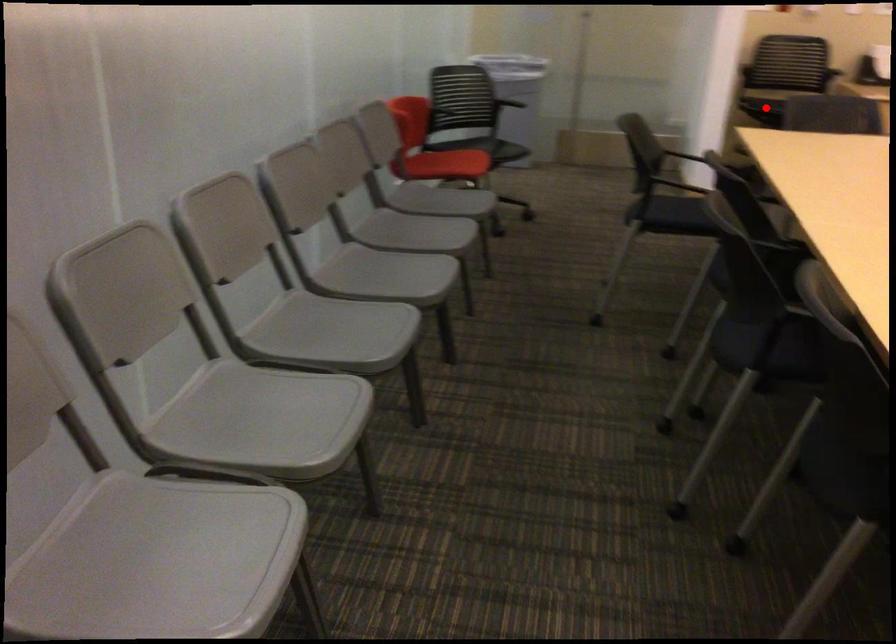
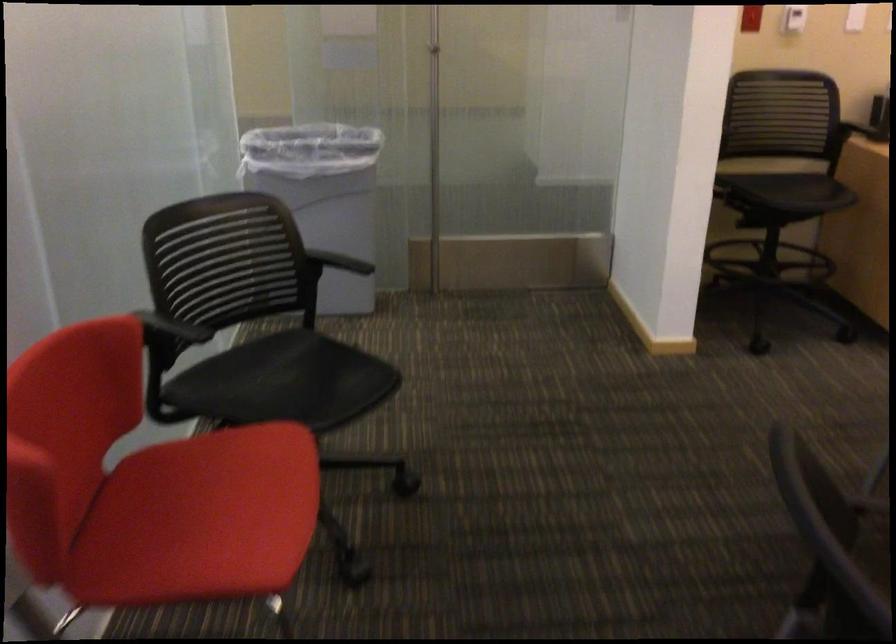
Question: I am providing you with two images of the same scene from different viewpoints. A red point is shown in image1. For the corresponding object point in image2, is it positioned nearer or farther from the camera?

Choices:
 (A) Nearer
 (B) Farther

Answer: (A)